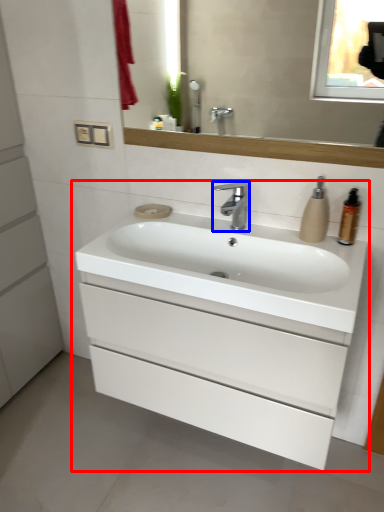
Question: Which object appears closest to the camera in this image, bathroom cabinet (highlighted by a red box) or tap (highlighted by a blue box)?

Choices:
 (A) bathroom cabinet
 (B) tap

Answer: (A)